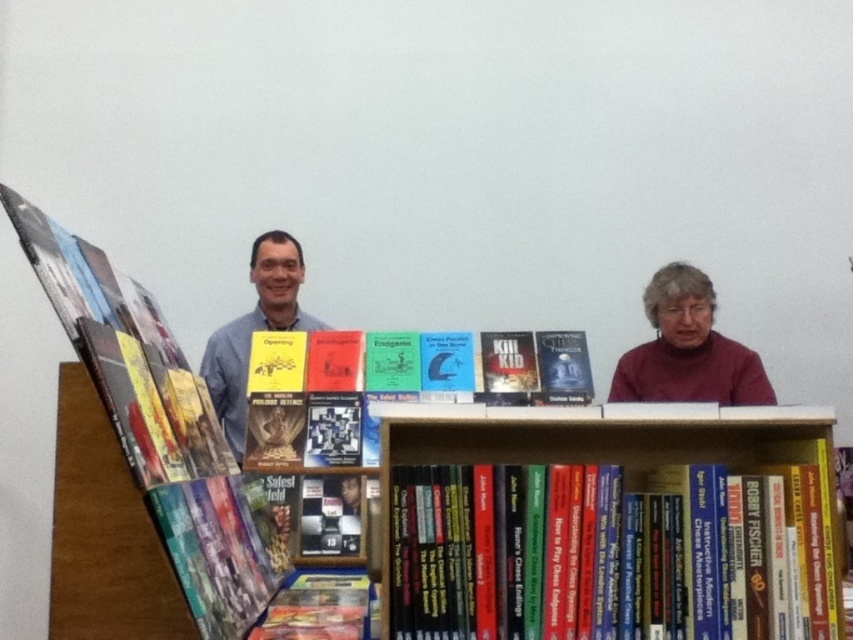
Question: Can you confirm if black hardcover book at center is positioned to the right of blue shirt at center?

Choices:
 (A) no
 (B) yes

Answer: (B)

Question: Which of the following is the farthest from the observer?

Choices:
 (A) (223, 470)
 (B) (222, 360)
 (C) (343, 593)
 (D) (300, 344)

Answer: (B)

Question: Does hardcover book at center appear on the left side of blue shirt at center?

Choices:
 (A) no
 (B) yes

Answer: (A)

Question: Which object appears farthest from the camera in this image?

Choices:
 (A) yellow paperback book at left
 (B) blue shirt at center

Answer: (B)

Question: Which object is closer to the camera taking this photo?

Choices:
 (A) maroon sweater at upper right
 (B) yellow paperback book at left

Answer: (B)

Question: Does black hardcover book at center appear on the right side of hardcover book at center?

Choices:
 (A) no
 (B) yes

Answer: (B)